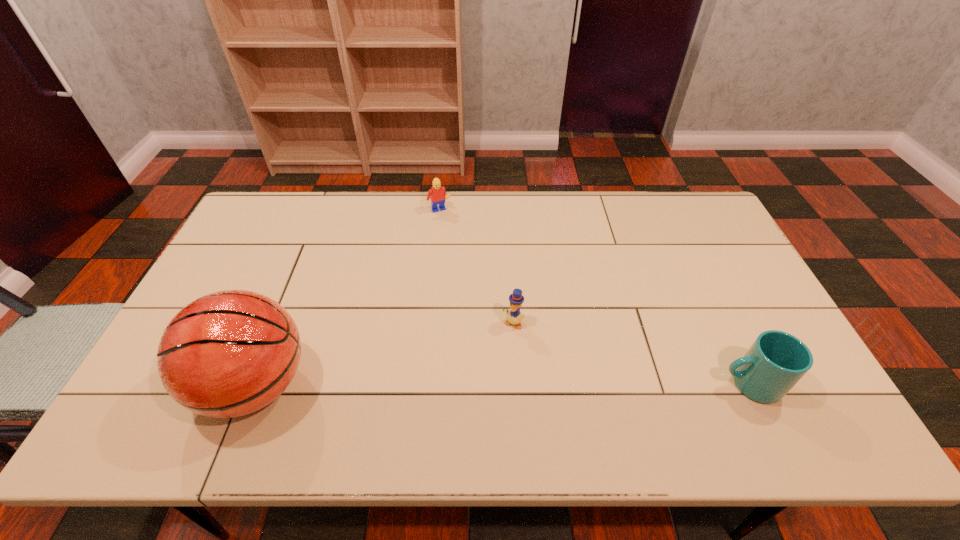
Find the location of a particular element. The width and height of the screenshot is (960, 540). free spot on the desktop that is between the leftmost object and the rightmost object and is positioned on the front-facing side of the farthest object is located at coordinates (533, 384).

Where is `free spot on the desktop that is between the leftmost object and the rightmost object and is positioned on the face of the third object from left to right, where the monocle is placed`? The image size is (960, 540). free spot on the desktop that is between the leftmost object and the rightmost object and is positioned on the face of the third object from left to right, where the monocle is placed is located at coordinates (480, 384).